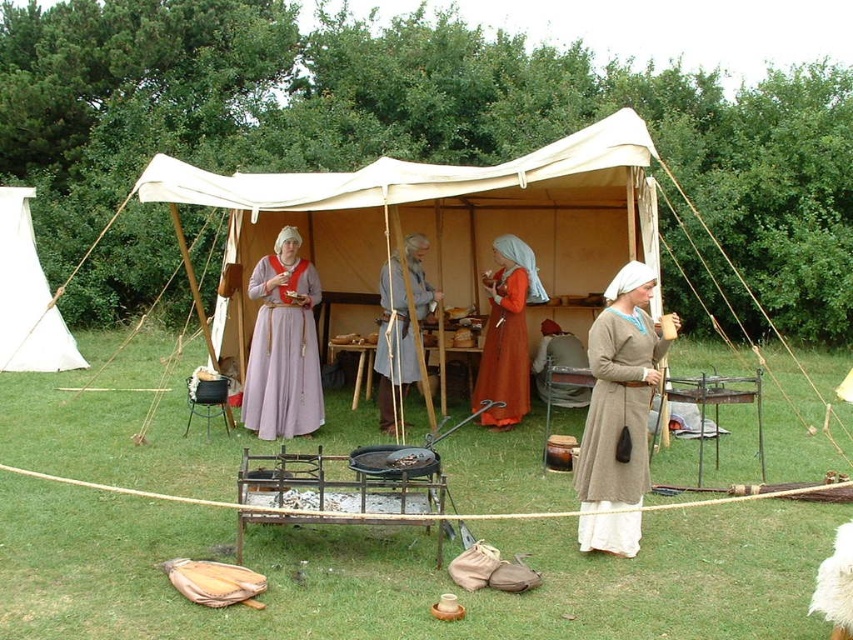
Can you confirm if matte purple gown at center is thinner than brown leather apron at center?

No, matte purple gown at center is not thinner than brown leather apron at center.

Which of these two, matte purple gown at center or brown leather apron at center, stands shorter?

brown leather apron at center

Who is more forward, (283, 381) or (395, 278)?

Positioned in front is point (283, 381).

In order to click on matte purple gown at center in this screenshot , I will do `click(283, 346)`.

Between orange velvet dress at center and brown leather apron at center, which one appears on the right side from the viewer's perspective?

orange velvet dress at center is more to the right.

The height and width of the screenshot is (640, 853). I want to click on orange velvet dress at center, so click(508, 333).

Between point (77, 358) and point (505, 282), which one is positioned behind?

Positioned behind is point (77, 358).

Which is above, white canvas tent at left or orange velvet dress at center?

white canvas tent at left

Does point (3, 342) come behind point (511, 337)?

Yes.

At what (x,y) coordinates should I click in order to perform the action: click on white canvas tent at left. Please return your answer as a coordinate pair (x, y). This screenshot has width=853, height=640. Looking at the image, I should click on (27, 296).